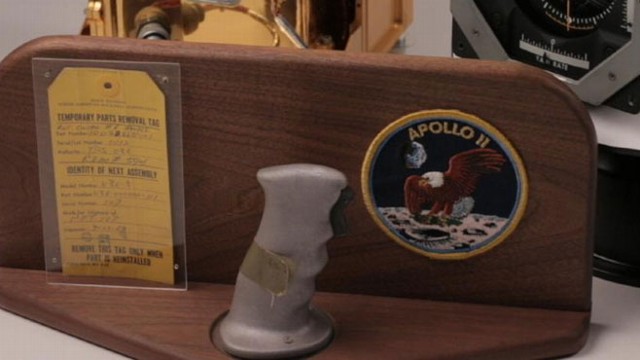
Identify the location of white table surface. (608, 339).